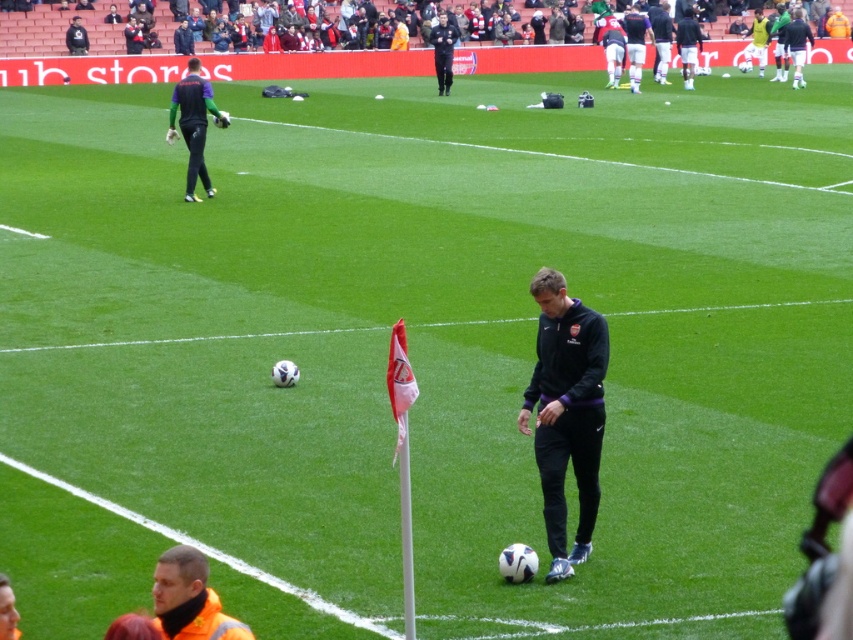
You are a referee on the soccer field and need to locate both the reflective orange vest at lower center and the dark green jersey at upper left. Which of these two items is closer to the ground?

The reflective orange vest at lower center is positioned under the dark green jersey at upper left, so it is closer to the ground.

You are a coach observing the soccer field. You notice the black fleece jacket at center and the reflective orange vest at lower center. How far apart are these two items from each other?

The black fleece jacket at center and reflective orange vest at lower center are 10.54 feet apart.

You are a photographer positioned at the edge of the soccer field. You need to capture a photo that includes both the black fleece jacket at center and the dark green jersey at upper left. Based on their positions and sizes, which object will appear larger in the final photo?

The black fleece jacket at center will appear larger in the photo because it has a greater height compared to the dark green jersey at upper left.